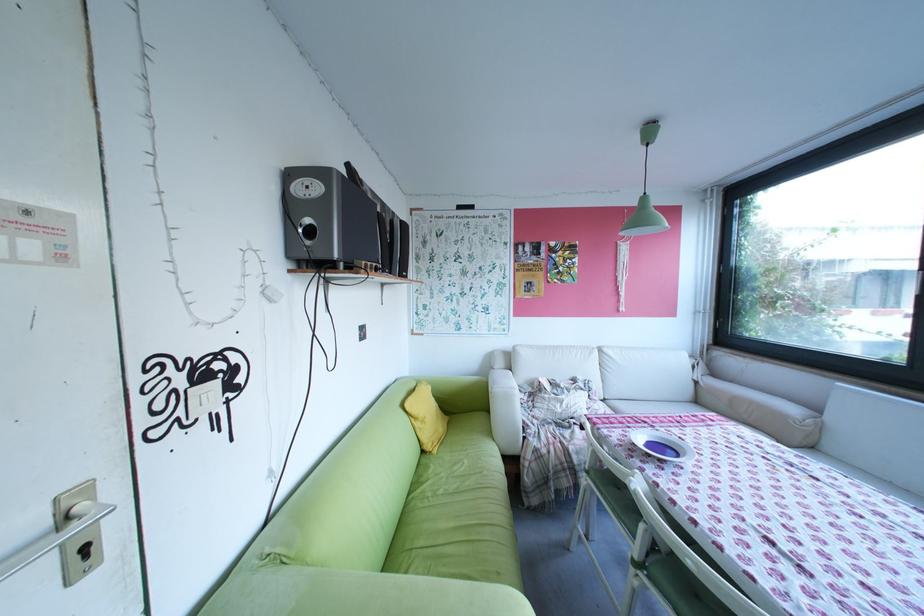
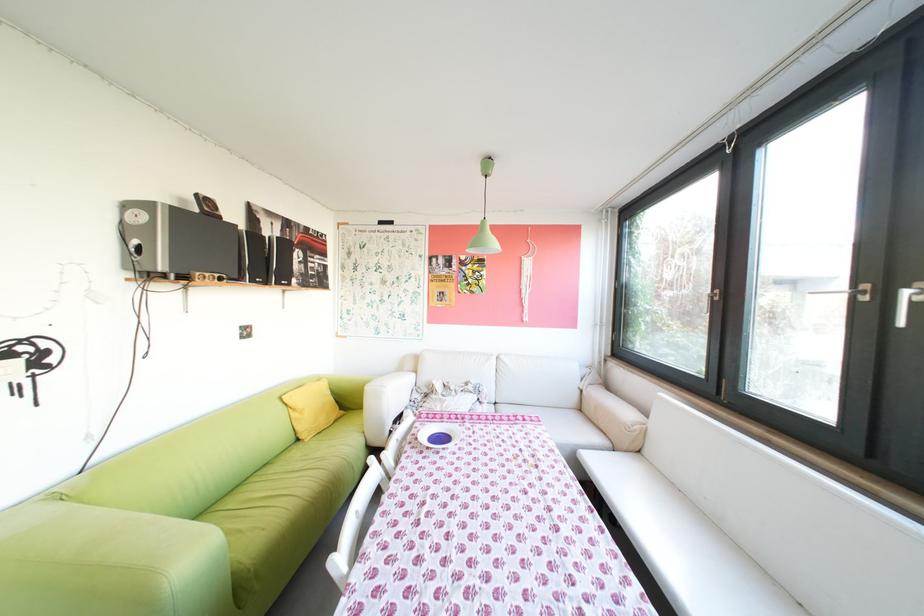
Find the pixel in the second image that matches point 447,451 in the first image.

(321, 440)